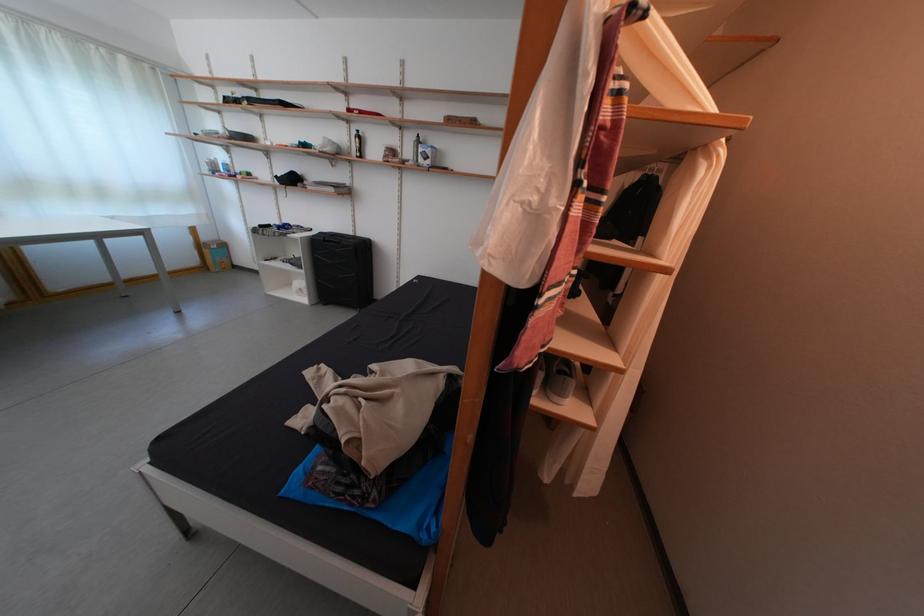
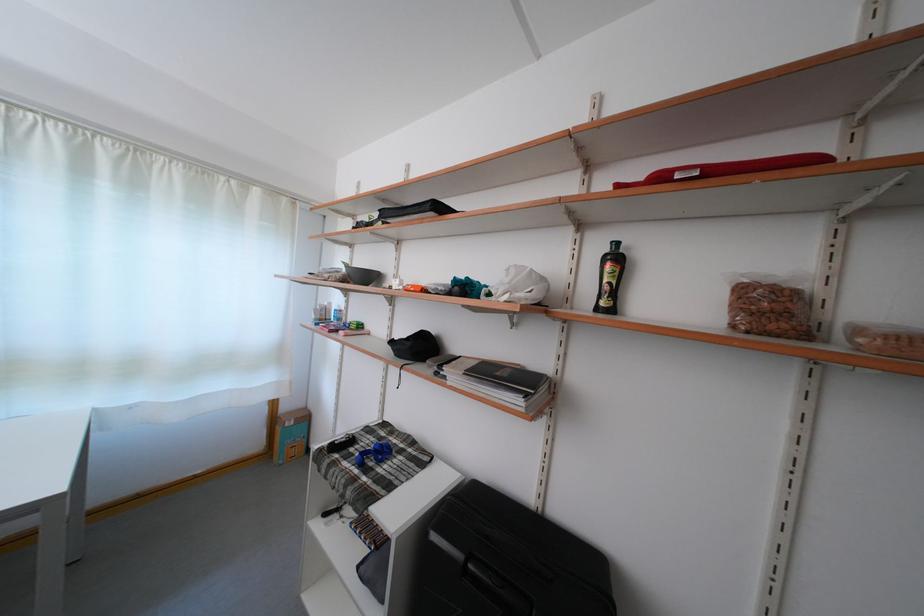
Locate, in the second image, the point that corresponds to (x=213, y=244) in the first image.

(293, 415)